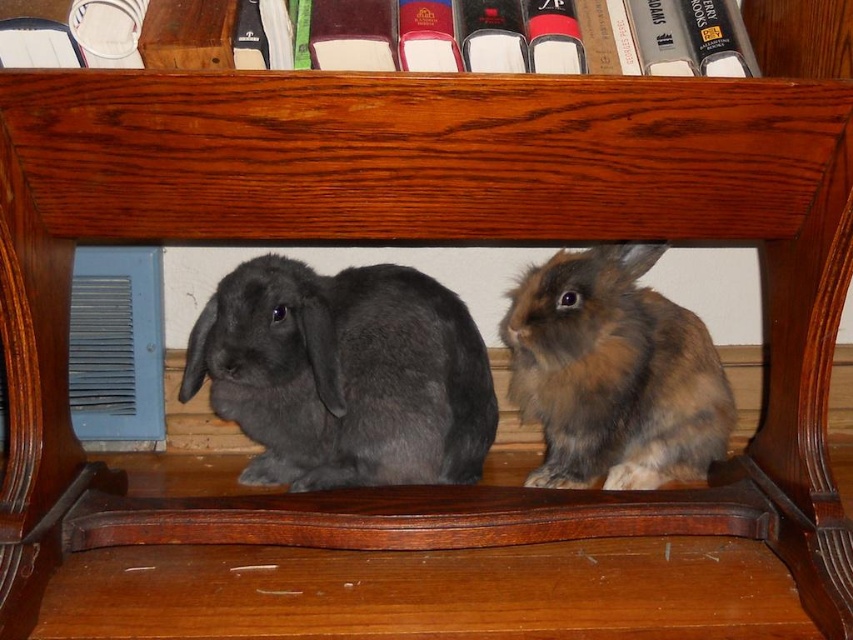
Which is in front, point (335, 314) or point (611, 308)?

Point (335, 314) is more forward.

Does matte gray rabbit at center have a smaller size compared to brown fluffy rabbit at center?

Yes.

In order to click on matte gray rabbit at center in this screenshot , I will do `click(344, 374)`.